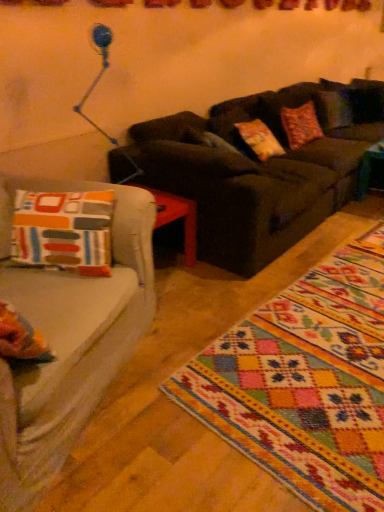
Question: From a real-world perspective, is dark brown leather couch at center physically below multicolored woven rug at lower right?

Choices:
 (A) yes
 (B) no

Answer: (B)

Question: Is dark brown leather couch at center thinner than multicolored woven rug at lower right?

Choices:
 (A) yes
 (B) no

Answer: (A)

Question: Is dark brown leather couch at center not close to multicolored woven rug at lower right?

Choices:
 (A) yes
 (B) no

Answer: (A)

Question: Does dark brown leather couch at center have a greater width compared to multicolored woven rug at lower right?

Choices:
 (A) no
 (B) yes

Answer: (A)

Question: Is dark brown leather couch at center in front of multicolored woven rug at lower right?

Choices:
 (A) yes
 (B) no

Answer: (B)

Question: Is dark brown leather couch at center positioned with its back to multicolored woven rug at lower right?

Choices:
 (A) no
 (B) yes

Answer: (A)

Question: Is multicolored woven rug at lower right to the right of dark brown leather couch at center from the viewer's perspective?

Choices:
 (A) no
 (B) yes

Answer: (B)

Question: Are multicolored woven rug at lower right and dark brown leather couch at center making contact?

Choices:
 (A) yes
 (B) no

Answer: (B)

Question: Is there a large distance between multicolored woven rug at lower right and dark brown leather couch at center?

Choices:
 (A) no
 (B) yes

Answer: (B)

Question: From a real-world perspective, is multicolored woven rug at lower right located beneath dark brown leather couch at center?

Choices:
 (A) no
 (B) yes

Answer: (B)

Question: Can you confirm if multicolored woven rug at lower right is bigger than dark brown leather couch at center?

Choices:
 (A) no
 (B) yes

Answer: (A)

Question: From a real-world perspective, is multicolored woven rug at lower right over dark brown leather couch at center?

Choices:
 (A) yes
 (B) no

Answer: (B)

Question: Visually, is dark brown leather couch at center positioned to the left or to the right of multicolored woven rug at lower right?

Choices:
 (A) right
 (B) left

Answer: (B)